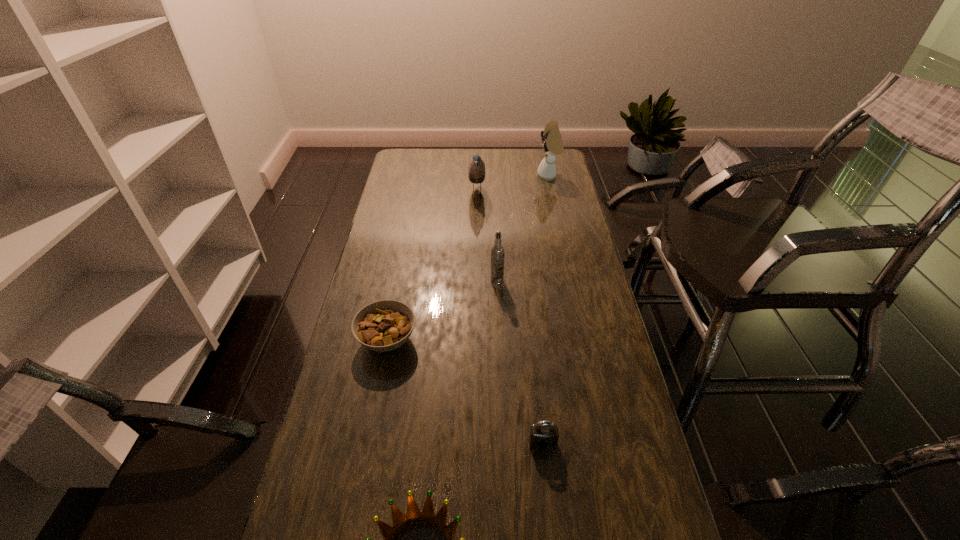
Image resolution: width=960 pixels, height=540 pixels. I want to click on vacant area in the image that satisfies the following two spatial constraints: 1. at the front face of the rightmost object; 2. on the front side of the shortest object, so click(586, 340).